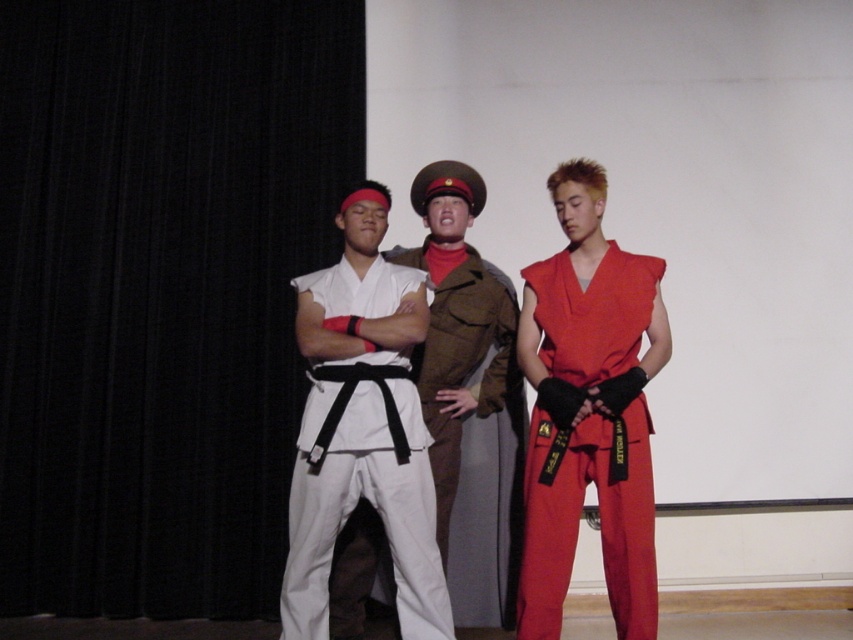
Question: Is matte red jumpsuit at right to the right of brown woolen uniform at center from the viewer's perspective?

Choices:
 (A) no
 (B) yes

Answer: (B)

Question: Which is farther from the brown woolen uniform at center?

Choices:
 (A) white matte karate uniform at center
 (B) matte red jumpsuit at right

Answer: (B)

Question: Considering the relative positions of matte red jumpsuit at right and brown woolen uniform at center in the image provided, where is matte red jumpsuit at right located with respect to brown woolen uniform at center?

Choices:
 (A) above
 (B) below

Answer: (B)

Question: Which is farther from the white matte karate uniform at center?

Choices:
 (A) matte red jumpsuit at right
 (B) brown woolen uniform at center

Answer: (A)

Question: Can you confirm if white matte karate uniform at center is positioned to the left of brown woolen uniform at center?

Choices:
 (A) yes
 (B) no

Answer: (A)

Question: Which of the following is the closest to the observer?

Choices:
 (A) (483, 554)
 (B) (357, 481)
 (C) (653, 618)

Answer: (C)